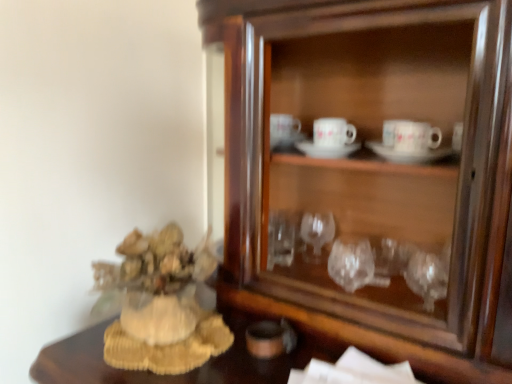
Measure the distance between wooden cabinet at center and camera.

19.60 inches.

You are a GUI agent. You are given a task and a screenshot of the screen. Output one action in this format:
    pyautogui.click(x=<x>, y=<y>)
    Task: Click on the wooden cabinet at center
    This screenshot has height=384, width=512.
    Given the screenshot: What is the action you would take?
    pyautogui.click(x=370, y=175)

The image size is (512, 384). Describe the element at coordinates (370, 175) in the screenshot. I see `wooden cabinet at center` at that location.

Image resolution: width=512 pixels, height=384 pixels. Identify the location of wooden cabinet at center. (370, 175).